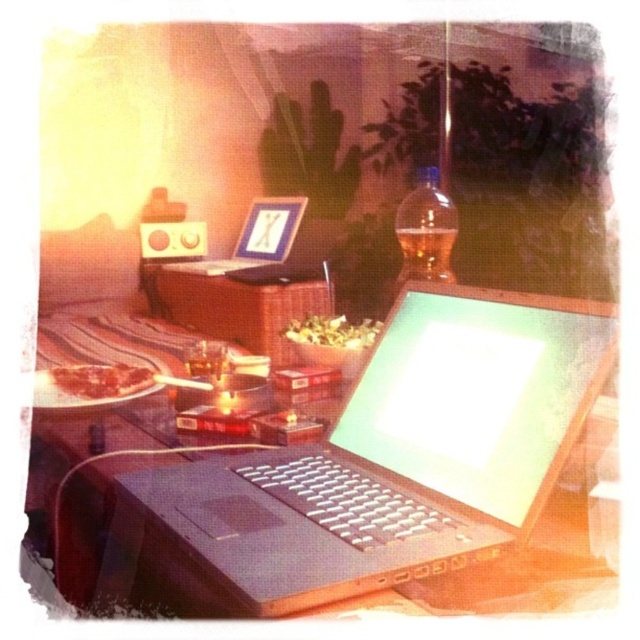
Who is shorter, satin black laptop at center or matte plastic speaker at upper left?

Standing shorter between the two is matte plastic speaker at upper left.

Is satin black laptop at center smaller than matte plastic speaker at upper left?

Incorrect, satin black laptop at center is not smaller in size than matte plastic speaker at upper left.

This screenshot has height=640, width=640. I want to click on satin black laptop at center, so click(x=378, y=465).

Between satin black laptop at center and black matte laptop at center, which one has more height?

satin black laptop at center

Does satin black laptop at center have a greater height compared to black matte laptop at center?

Yes.

Is point (163, 502) behind point (212, 268)?

No, it is in front of (212, 268).

This screenshot has width=640, height=640. What are the coordinates of `satin black laptop at center` in the screenshot? It's located at (378, 465).

Measure the distance between black matte laptop at center and matte plastic speaker at upper left.

black matte laptop at center and matte plastic speaker at upper left are 7.71 inches apart.

Does black matte laptop at center appear under matte plastic speaker at upper left?

Yes, black matte laptop at center is below matte plastic speaker at upper left.

Where is `black matte laptop at center`? black matte laptop at center is located at coordinates (257, 237).

The width and height of the screenshot is (640, 640). Identify the location of black matte laptop at center. (257, 237).